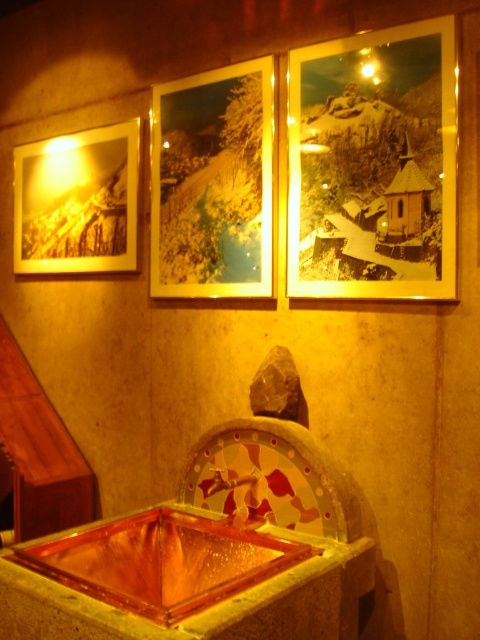
Question: Which of the following is the farthest from the observer?

Choices:
 (A) gold-framed photo at center
 (B) gold-framed photo at upper right

Answer: (A)

Question: Can you confirm if gold-framed photo at upper right is bigger than matte paper photo at upper left?

Choices:
 (A) yes
 (B) no

Answer: (B)

Question: Does gold-framed photo at upper right appear on the right side of gold-framed photo at center?

Choices:
 (A) yes
 (B) no

Answer: (A)

Question: Estimate the real-world distances between objects in this image. Which object is closer to the gold-framed photo at upper right?

Choices:
 (A) gold-framed photo at center
 (B) matte paper photo at upper left

Answer: (A)

Question: Can you confirm if gold-framed photo at upper right is wider than matte paper photo at upper left?

Choices:
 (A) no
 (B) yes

Answer: (A)

Question: Among these points, which one is nearest to the camera?

Choices:
 (A) (37, 216)
 (B) (154, 108)

Answer: (B)